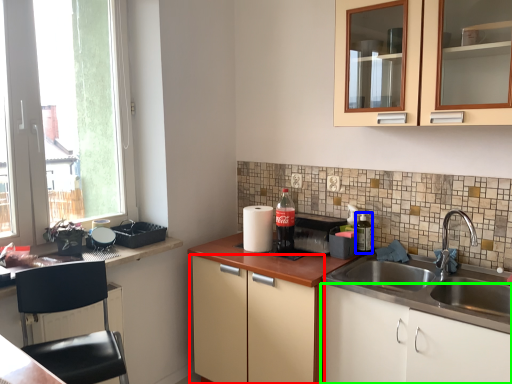
Question: Which is farther away from cabinetry (highlighted by a red box)? bottle (highlighted by a blue box) or cabinetry (highlighted by a green box)?

Choices:
 (A) bottle
 (B) cabinetry

Answer: (A)